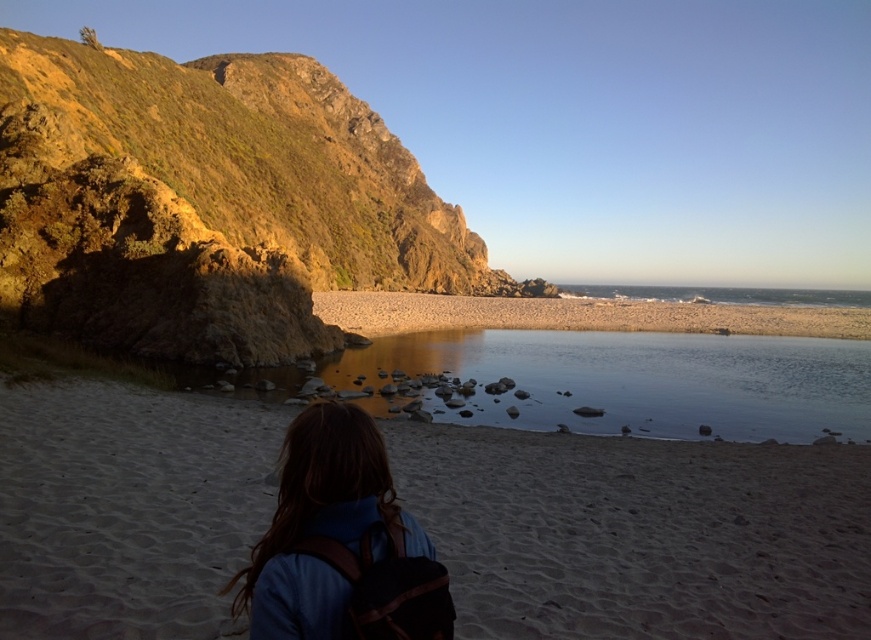
You are standing at the point with coordinates point (292, 509) and want to walk to the point with coordinates point (768, 416). Given that the path between them is clear, in which direction should you head relative to your current position?

You should head north because point (768, 416) is behind point (292, 509), indicating it is in the northern direction from your current position.

Based on the photo, you are a hiker who wants to take a photo of the smooth reflective water at center without the rustic stone cliff at left blocking the view. Is it possible to do so from your current position?

The rustic stone cliff at left is much taller than the smooth reflective water at center, so it might block the view. However, since the cliff is to the left and the water is at the center, moving slightly to the right could position the cliff out of frame, allowing you to capture the smooth reflective water at center without obstruction.

You are a hiker who has just reached the beach. You see the sandy beach at lower center and the smooth beige sand at center. Which one is closer to your current position?

The sandy beach at lower center is closer to your current position because it is located below the smooth beige sand at center.